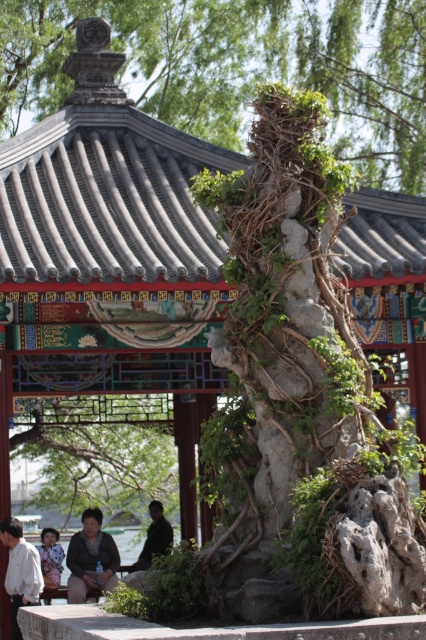
Question: Is green leafy tree at center to the left of matte black jacket at lower left from the viewer's perspective?

Choices:
 (A) no
 (B) yes

Answer: (B)

Question: Can you confirm if white cotton shirt at lower left is bigger than dark brown leather jacket at lower center?

Choices:
 (A) yes
 (B) no

Answer: (B)

Question: Is green leafy tree at upper center below dark brown leather jacket at lower center?

Choices:
 (A) no
 (B) yes

Answer: (A)

Question: Among these objects, which one is farthest from the camera?

Choices:
 (A) green leafy tree at center
 (B) matte black jacket at lower left

Answer: (A)

Question: Which object is farther from the camera taking this photo?

Choices:
 (A) green leafy tree at upper center
 (B) dark brown leather jacket at lower center
 (C) floral-patterned fabric at lower left

Answer: (A)

Question: Which point appears farthest from the camera in this image?

Choices:
 (A) (118, 490)
 (B) (52, 568)
 (C) (11, 524)

Answer: (A)